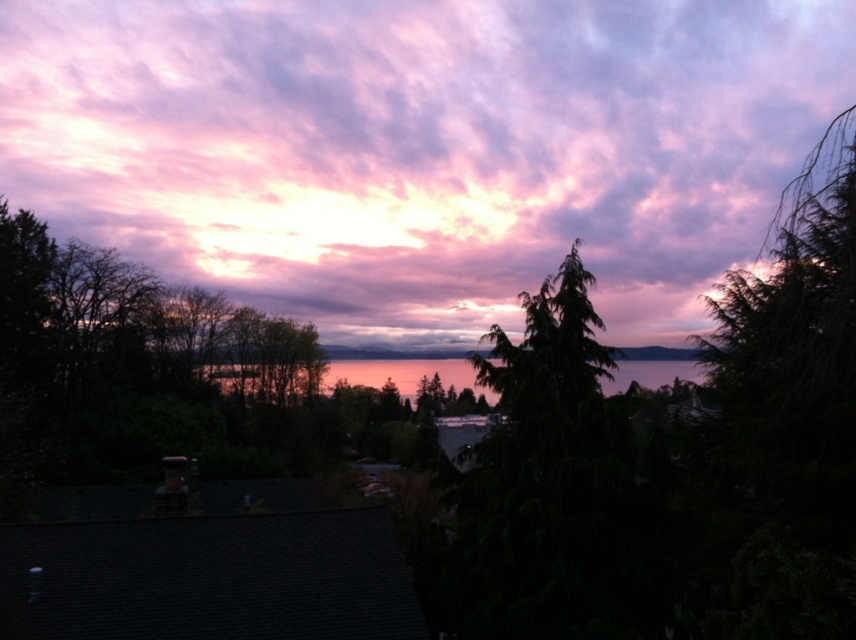
Can you confirm if pink fluffy cloud at upper center is smaller than green matte tree at center?

No, pink fluffy cloud at upper center is not smaller than green matte tree at center.

Who is shorter, pink fluffy cloud at upper center or green matte tree at center?

Standing shorter between the two is green matte tree at center.

Does point (758, 67) come closer to viewer compared to point (544, 419)?

That is False.

The image size is (856, 640). Find the location of `pink fluffy cloud at upper center`. pink fluffy cloud at upper center is located at coordinates coord(421,147).